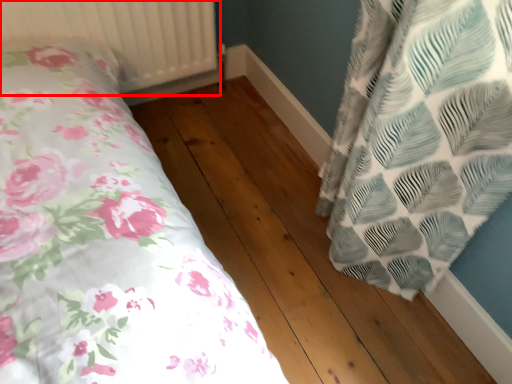
Question: From the image's perspective, where is radiator (annotated by the red box) located in relation to hardwood in the image?

Choices:
 (A) above
 (B) below

Answer: (A)